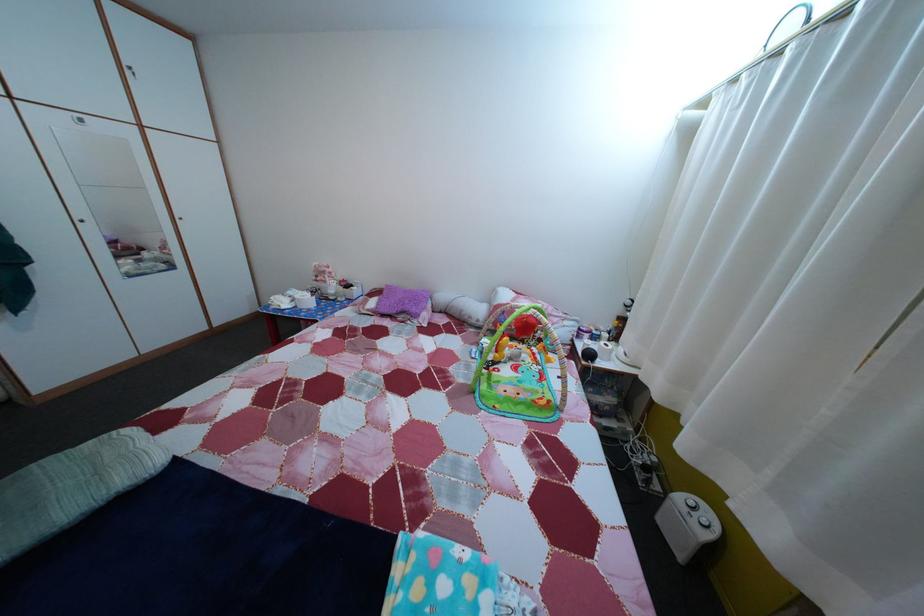
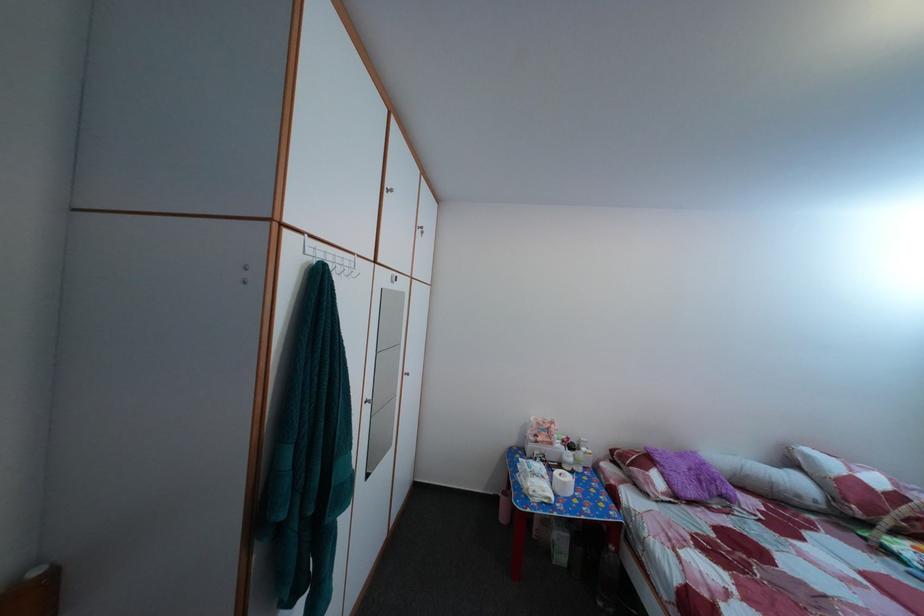
Locate, in the second image, the point that corresponds to point 286,310 in the first image.

(551, 500)